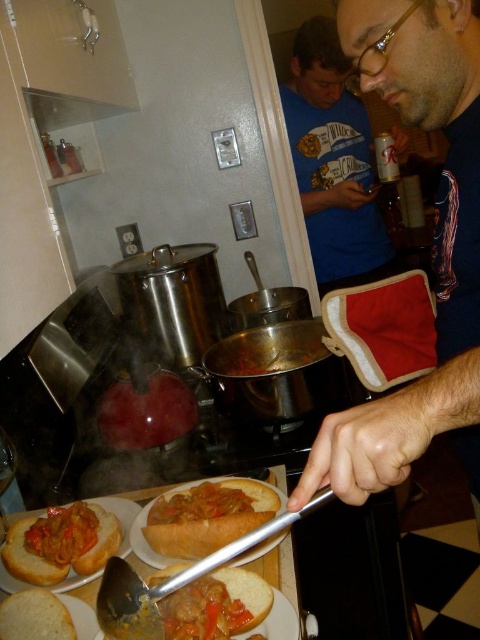
From the picture: Who is positioned more to the left, matte black oven mitt at center or white bread at lower left?

white bread at lower left is more to the left.

Who is shorter, matte black oven mitt at center or white bread at lower left?

With less height is white bread at lower left.

Between point (368, 492) and point (67, 612), which one is positioned in front?

Point (368, 492) is in front.

What are the coordinates of `matte black oven mitt at center` in the screenshot? It's located at (433, 244).

Which is in front, point (459, 152) or point (133, 630)?

Point (133, 630)

Locate an element on the screen. Image resolution: width=480 pixels, height=640 pixels. matte black oven mitt at center is located at coordinates (433, 244).

The height and width of the screenshot is (640, 480). What are the coordinates of `matte black oven mitt at center` in the screenshot? It's located at coord(433,244).

Identify the location of matte black oven mitt at center. pos(433,244).

Can you confirm if matte black oven mitt at center is positioned below matte blue shirt at upper center?

Correct, matte black oven mitt at center is located below matte blue shirt at upper center.

Is matte black oven mitt at center smaller than matte blue shirt at upper center?

Correct, matte black oven mitt at center occupies less space than matte blue shirt at upper center.

The width and height of the screenshot is (480, 640). In order to click on matte black oven mitt at center in this screenshot , I will do `click(433, 244)`.

You are a GUI agent. You are given a task and a screenshot of the screen. Output one action in this format:
    pyautogui.click(x=<x>, y=<y>)
    Task: Click on the matte black oven mitt at center
    This screenshot has width=480, height=640.
    Given the screenshot: What is the action you would take?
    pyautogui.click(x=433, y=244)